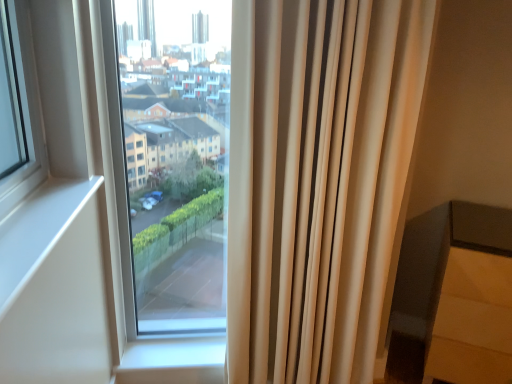
Question: Is transparent glass window at center at the left side of beige fabric curtain at right?

Choices:
 (A) yes
 (B) no

Answer: (A)

Question: Considering the relative sizes of transparent glass window at center and beige fabric curtain at right in the image provided, is transparent glass window at center bigger than beige fabric curtain at right?

Choices:
 (A) yes
 (B) no

Answer: (A)

Question: From a real-world perspective, is transparent glass window at center beneath beige fabric curtain at right?

Choices:
 (A) no
 (B) yes

Answer: (A)

Question: Is transparent glass window at center next to beige fabric curtain at right?

Choices:
 (A) no
 (B) yes

Answer: (A)

Question: Does transparent glass window at center have a greater height compared to beige fabric curtain at right?

Choices:
 (A) no
 (B) yes

Answer: (A)

Question: Would you say transparent glass window at center contains beige fabric curtain at right?

Choices:
 (A) yes
 (B) no

Answer: (B)

Question: From the image's perspective, would you say beige fabric curtain at right is positioned over transparent glass window at center?

Choices:
 (A) no
 (B) yes

Answer: (A)

Question: Does beige fabric curtain at right come in front of transparent glass window at center?

Choices:
 (A) no
 (B) yes

Answer: (B)

Question: Can you confirm if beige fabric curtain at right is shorter than transparent glass window at center?

Choices:
 (A) no
 (B) yes

Answer: (A)

Question: From the image's perspective, is beige fabric curtain at right under transparent glass window at center?

Choices:
 (A) no
 (B) yes

Answer: (B)

Question: Is beige fabric curtain at right thinner than transparent glass window at center?

Choices:
 (A) yes
 (B) no

Answer: (B)

Question: Considering the relative sizes of beige fabric curtain at right and transparent glass window at center in the image provided, is beige fabric curtain at right smaller than transparent glass window at center?

Choices:
 (A) no
 (B) yes

Answer: (B)

Question: Is beige fabric curtain at right completely or partially inside matte gray chair at lower right?

Choices:
 (A) yes
 (B) no

Answer: (B)